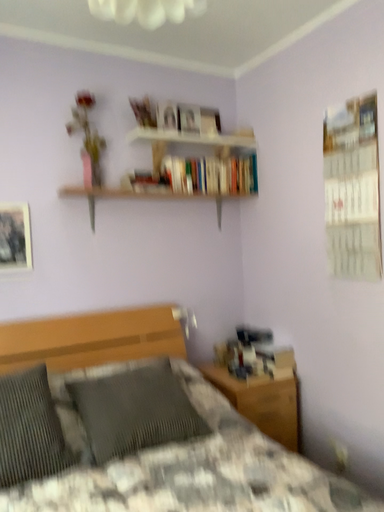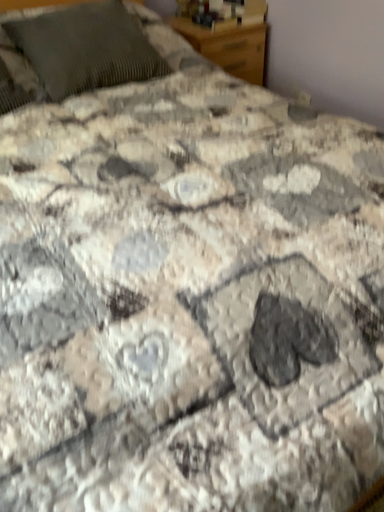
Question: Which way did the camera rotate in the video?

Choices:
 (A) rotated downward
 (B) rotated upward

Answer: (A)